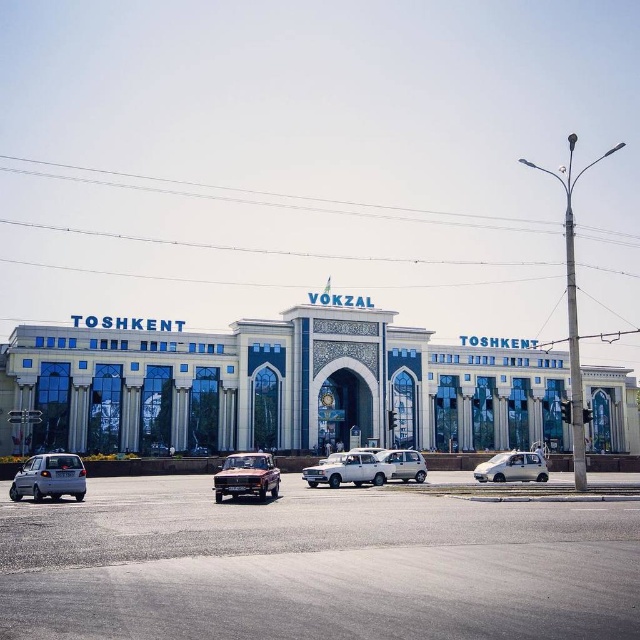
Who is taller, silver metallic hatchback at lower left or satin silver sedan at center?

Standing taller between the two is silver metallic hatchback at lower left.

Can you confirm if silver metallic hatchback at lower left is positioned above satin silver sedan at center?

Yes.

Is point (77, 460) more distant than point (384, 451)?

No, it is in front of (384, 451).

Locate an element on the screen. silver metallic hatchback at lower left is located at coordinates (49, 477).

Between point (264, 326) and point (268, 461), which one is positioned in front?

Point (268, 461) is in front.

Is white glass building at center further to the viewer compared to rustic metallic car at center?

Yes, it is behind rustic metallic car at center.

I want to click on white glass building at center, so click(275, 387).

This screenshot has height=640, width=640. Identify the location of white glass building at center. (275, 387).

Between white glass building at center and silver metallic car at center, which one appears on the right side from the viewer's perspective?

silver metallic car at center

Can you confirm if white glass building at center is bigger than silver metallic car at center?

Correct, white glass building at center is larger in size than silver metallic car at center.

Is point (264, 372) more distant than point (502, 454)?

Yes, point (264, 372) is behind point (502, 454).

At what (x,y) coordinates should I click in order to perform the action: click on white glass building at center. Please return your answer as a coordinate pair (x, y). The image size is (640, 640). Looking at the image, I should click on (275, 387).